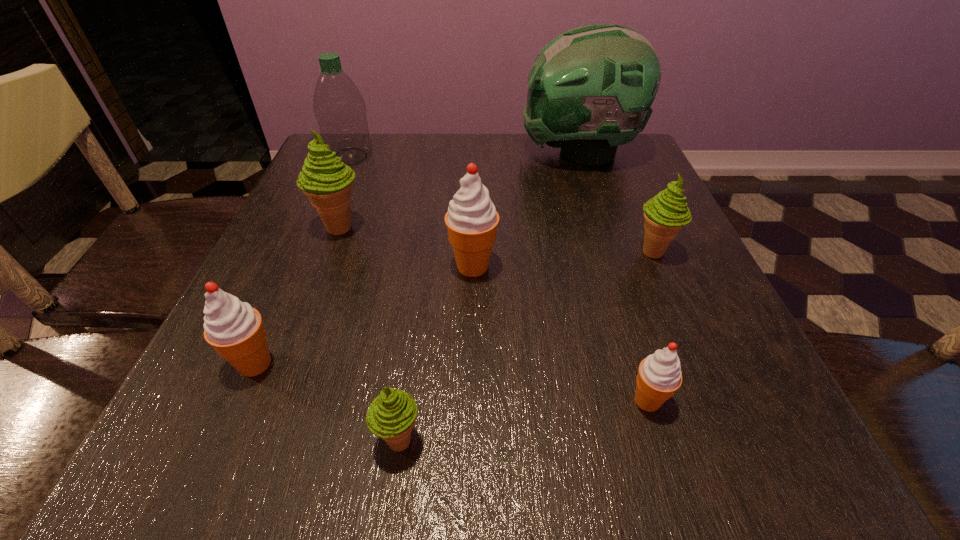
I want to click on green icecream that is the closest to the biggest green icecream, so click(391, 415).

Identify the location of the third closest red icecream to the green football helmet. The height and width of the screenshot is (540, 960). (235, 330).

Identify which red icecream is the second nearest to the green water bottle. Please provide its 2D coordinates. Your answer should be formatted as a tuple, i.e. [(x, y)], where the tuple contains the x and y coordinates of a point satisfying the conditions above.

[(235, 330)]

What are the coordinates of `vacant area in the image that satisfies the following two spatial constraints: 1. on the front side of the farthest red icecream; 2. on the right side of the leftmost green icecream` in the screenshot? It's located at (325, 266).

Where is `vacant point that satisfies the following two spatial constraints: 1. on the visor of the green football helmet; 2. on the right side of the rightmost icecream`? Image resolution: width=960 pixels, height=540 pixels. vacant point that satisfies the following two spatial constraints: 1. on the visor of the green football helmet; 2. on the right side of the rightmost icecream is located at coordinates (611, 251).

Identify the location of vacant space that satisfies the following two spatial constraints: 1. on the back side of the rightmost icecream; 2. on the right side of the fifth icecream from left to right. The image size is (960, 540). (602, 251).

Where is `vacant area in the image that satisfies the following two spatial constraints: 1. on the back side of the rightmost green icecream; 2. on the visor of the football helmet`? vacant area in the image that satisfies the following two spatial constraints: 1. on the back side of the rightmost green icecream; 2. on the visor of the football helmet is located at coordinates (612, 153).